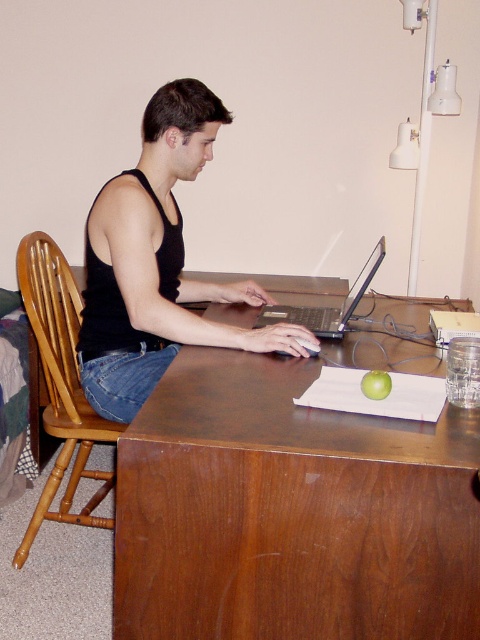
You are standing in front of the desk and want to reach the point marked at coordinates (452, 490). Considering your arm can extend 3 feet, can you reach it without moving closer?

The point at (452, 490) is 3.88 feet away from the viewer, which is beyond the arm extension of 3 feet. You cannot reach it without moving closer.

You are a virtual assistant trying to describe the scene to someone who can only hear your description. You need to mention both the black matte tank top at center and the green matte apple at center. Which object is covering the other?

The black matte tank top at center is positioned over the green matte apple at center, so the tank top is covering the apple.